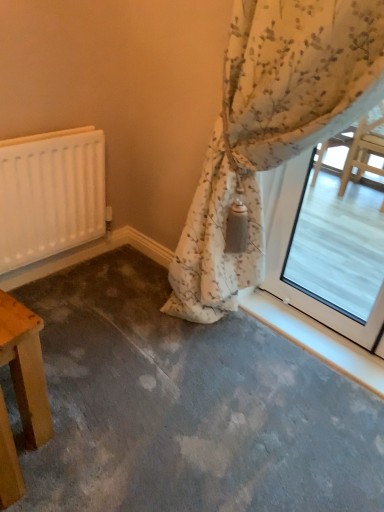
Describe the element at coordinates (25, 368) in the screenshot. I see `wooden table at lower left` at that location.

Describe the element at coordinates (50, 194) in the screenshot. I see `white matte radiator at left` at that location.

You are a GUI agent. You are given a task and a screenshot of the screen. Output one action in this format:
    pyautogui.click(x=<x>, y=<y>)
    Task: Click on the floral fabric curtain at upper right
    This screenshot has width=384, height=512.
    Given the screenshot: What is the action you would take?
    pyautogui.click(x=271, y=128)

Is point (32, 332) closer or farther from the camera than point (249, 233)?

Point (32, 332).

From a real-world perspective, between wooden table at lower left and floral fabric curtain at upper right, who is vertically lower?

wooden table at lower left.

Considering the relative sizes of wooden table at lower left and floral fabric curtain at upper right in the image provided, is wooden table at lower left bigger than floral fabric curtain at upper right?

Actually, wooden table at lower left might be smaller than floral fabric curtain at upper right.

Could you tell me if wooden table at lower left is facing floral fabric curtain at upper right?

No, wooden table at lower left is not turned towards floral fabric curtain at upper right.

Measure the distance from floral fabric curtain at upper right to white matte radiator at left.

The distance of floral fabric curtain at upper right from white matte radiator at left is 25.96 inches.

From the image's perspective, relative to white matte radiator at left, is floral fabric curtain at upper right above or below?

floral fabric curtain at upper right is situated lower than white matte radiator at left in the image.

Is floral fabric curtain at upper right bigger or smaller than white matte radiator at left?

Clearly, floral fabric curtain at upper right is larger in size than white matte radiator at left.

Which of these two, floral fabric curtain at upper right or white matte radiator at left, stands taller?

floral fabric curtain at upper right.

In the scene shown: Is white matte radiator at left oriented towards wooden table at lower left?

Yes, white matte radiator at left is facing wooden table at lower left.

From the picture: Is white matte radiator at left far away from wooden table at lower left?

No, white matte radiator at left is in close proximity to wooden table at lower left.

Which object is positioned more to the left, white matte radiator at left or wooden table at lower left?

Positioned to the left is white matte radiator at left.

From the image's perspective, between white matte radiator at left and wooden table at lower left, who is located below?

wooden table at lower left.

Is wooden table at lower left closer to the viewer compared to white matte radiator at left?

Yes, the depth of wooden table at lower left is less than that of white matte radiator at left.

Measure the distance between wooden table at lower left and white matte radiator at left.

wooden table at lower left is 27.67 inches from white matte radiator at left.

Which object is positioned more to the left, wooden table at lower left or white matte radiator at left?

white matte radiator at left.

Based on the photo, from the image's perspective, is wooden table at lower left below white matte radiator at left?

Yes.

Considering the positions of points (72, 200) and (304, 34), is point (72, 200) farther from camera compared to point (304, 34)?

Yes, it is.

Is white matte radiator at left wider than floral fabric curtain at upper right?

In fact, white matte radiator at left might be narrower than floral fabric curtain at upper right.

This screenshot has width=384, height=512. Find the location of `radiator behind the floral fabric curtain at upper right`. radiator behind the floral fabric curtain at upper right is located at coordinates (x=50, y=194).

Are white matte radiator at left and floral fabric curtain at upper right far apart?

white matte radiator at left is actually quite close to floral fabric curtain at upper right.

Can you confirm if floral fabric curtain at upper right is wider than wooden table at lower left?

Yes.

In terms of height, does floral fabric curtain at upper right look taller or shorter compared to wooden table at lower left?

In the image, floral fabric curtain at upper right appears to be taller than wooden table at lower left.

Is floral fabric curtain at upper right oriented towards wooden table at lower left?

Yes, floral fabric curtain at upper right is facing wooden table at lower left.

Where is `table on the left of floral fabric curtain at upper right`? This screenshot has width=384, height=512. table on the left of floral fabric curtain at upper right is located at coordinates (25, 368).

At what (x,y) coordinates should I click in order to perform the action: click on radiator below the floral fabric curtain at upper right (from a real-world perspective). Please return your answer as a coordinate pair (x, y). Looking at the image, I should click on (50, 194).

Considering their positions, is wooden table at lower left positioned further to floral fabric curtain at upper right than white matte radiator at left?

wooden table at lower left lies further to floral fabric curtain at upper right than the other object.

Looking at the image, which one is located closer to floral fabric curtain at upper right, white matte radiator at left or wooden table at lower left?

Based on the image, white matte radiator at left appears to be nearer to floral fabric curtain at upper right.

When comparing their distances from white matte radiator at left, does wooden table at lower left or floral fabric curtain at upper right seem further?

The object further to white matte radiator at left is wooden table at lower left.

Looking at the image, which one is located further to white matte radiator at left, floral fabric curtain at upper right or wooden table at lower left?

wooden table at lower left is positioned further to the anchor white matte radiator at left.

Estimate the real-world distances between objects in this image. Which object is further from wooden table at lower left, floral fabric curtain at upper right or white matte radiator at left?

Based on the image, floral fabric curtain at upper right appears to be further to wooden table at lower left.

Looking at the image, which one is located further to wooden table at lower left, white matte radiator at left or floral fabric curtain at upper right?

floral fabric curtain at upper right is positioned further to the anchor wooden table at lower left.

I want to click on table between white matte radiator at left and floral fabric curtain at upper right from left to right, so click(x=25, y=368).